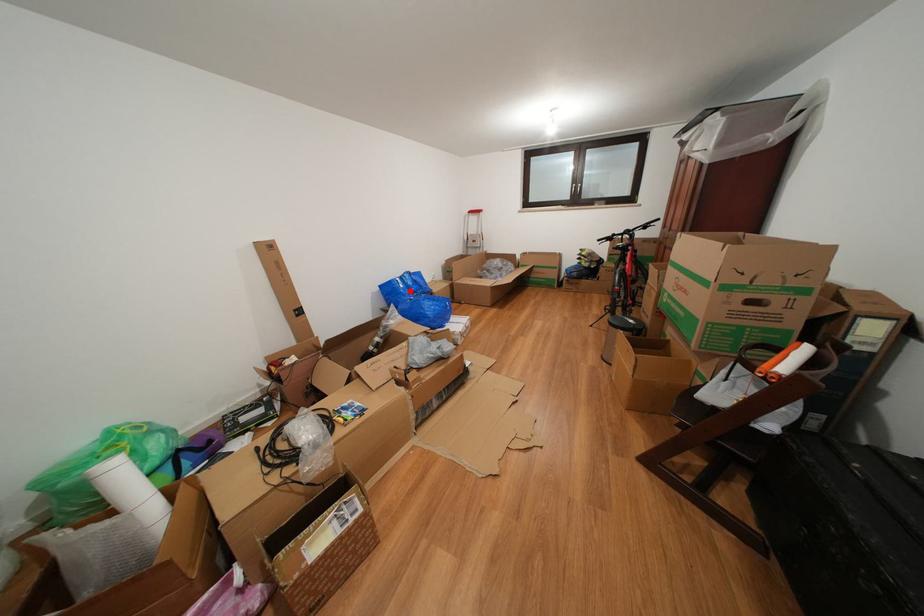
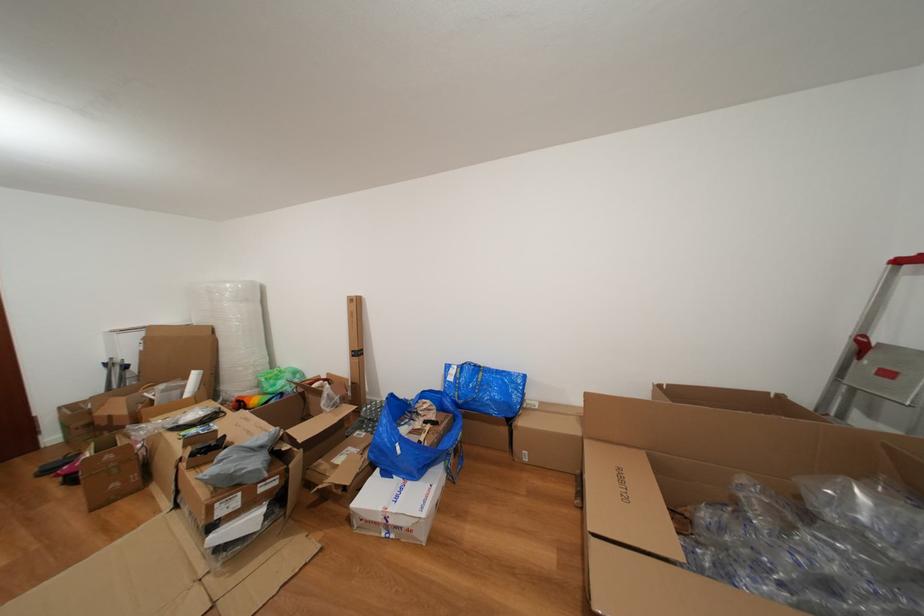
Where in the second image is the point corresponding to the highlighted location from the first image?

(458, 384)